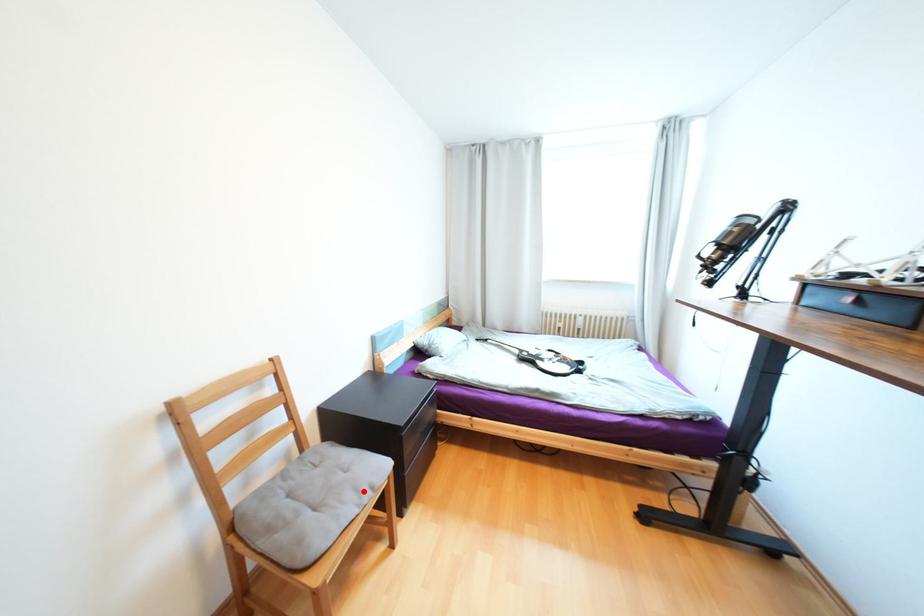
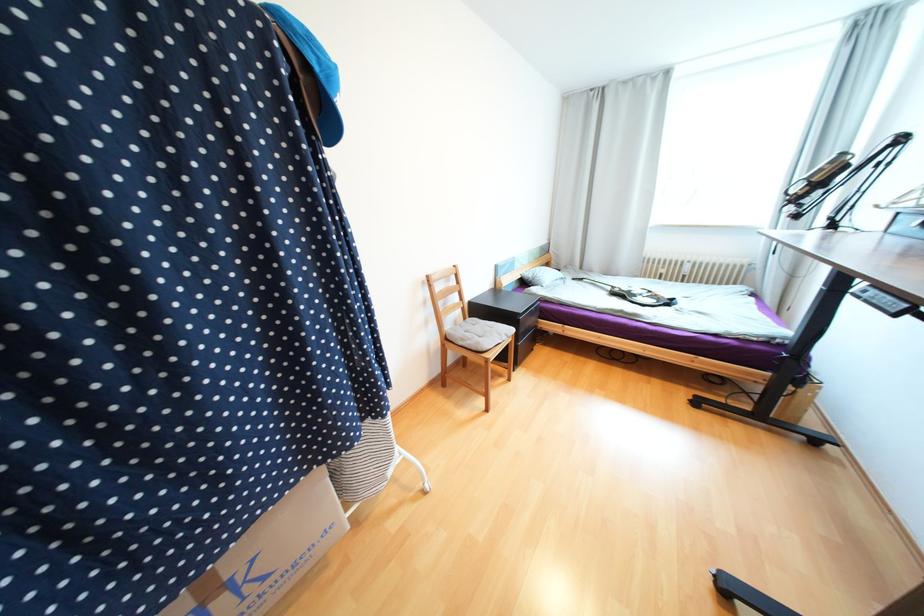
The point at the highlighted location is marked in the first image. Where is the corresponding point in the second image?

(505, 334)